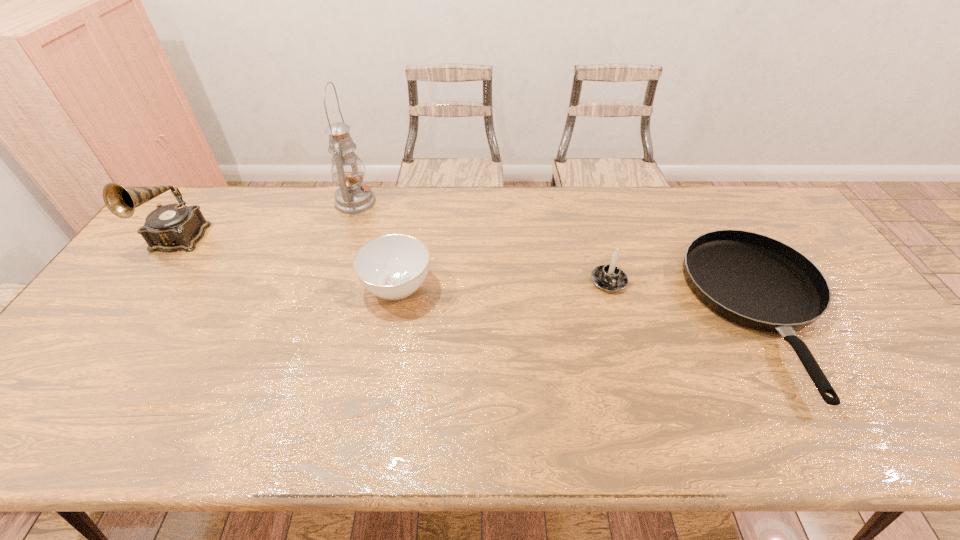
Where is `the second object from left to right`? The image size is (960, 540). the second object from left to right is located at coordinates (352, 197).

Locate an element on the screen. The image size is (960, 540). the tallest object is located at coordinates (352, 197).

Identify the location of phonograph record. The image size is (960, 540). (172, 227).

I want to click on the leftmost object, so click(x=172, y=227).

You are a GUI agent. You are given a task and a screenshot of the screen. Output one action in this format:
    pyautogui.click(x=<x>, y=<y>)
    Task: Click on the second object from right to left
    The width and height of the screenshot is (960, 540).
    Given the screenshot: What is the action you would take?
    pyautogui.click(x=610, y=278)

Locate an element on the screen. the third shortest object is located at coordinates (610, 278).

Where is `the fourth tallest object`? The width and height of the screenshot is (960, 540). the fourth tallest object is located at coordinates (393, 266).

The height and width of the screenshot is (540, 960). In order to click on the third object from left to right in this screenshot , I will do `click(393, 266)`.

Identify the location of the shortest object. The image size is (960, 540). (753, 280).

In order to click on frying pan in this screenshot , I will do `click(753, 280)`.